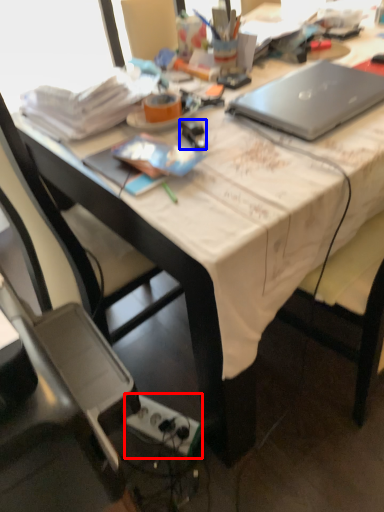
Question: Which object appears closest to the camera in this image, power outlet (highlighted by a red box) or stationery (highlighted by a blue box)?

Choices:
 (A) power outlet
 (B) stationery

Answer: (B)